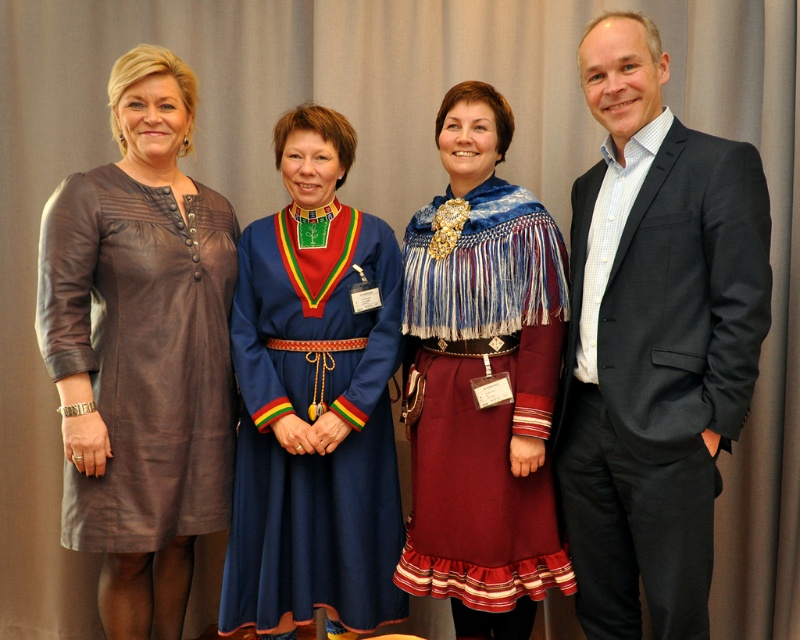
Does point (640, 387) come behind point (192, 236)?

No, it is not.

Is dark gray suit at right closer to the viewer compared to brown leather dress at left?

Yes, dark gray suit at right is in front of brown leather dress at left.

The image size is (800, 640). Describe the element at coordinates (654, 340) in the screenshot. I see `dark gray suit at right` at that location.

What are the coordinates of `dark gray suit at right` in the screenshot? It's located at (654, 340).

Does dark gray suit at right have a greater height compared to maroon fabric dress at center?

Yes.

Is dark gray suit at right shorter than maroon fabric dress at center?

No, dark gray suit at right is not shorter than maroon fabric dress at center.

Find the location of a particular element. dark gray suit at right is located at coordinates (654, 340).

Is point (564, 374) positioned in front of point (254, 586)?

Yes, point (564, 374) is closer to viewer.

Between dark gray suit at right and blue fabric dress at center, which one appears on the left side from the viewer's perspective?

Positioned to the left is blue fabric dress at center.

Is point (602, 250) closer to camera compared to point (332, 218)?

Yes.

The width and height of the screenshot is (800, 640). I want to click on dark gray suit at right, so click(654, 340).